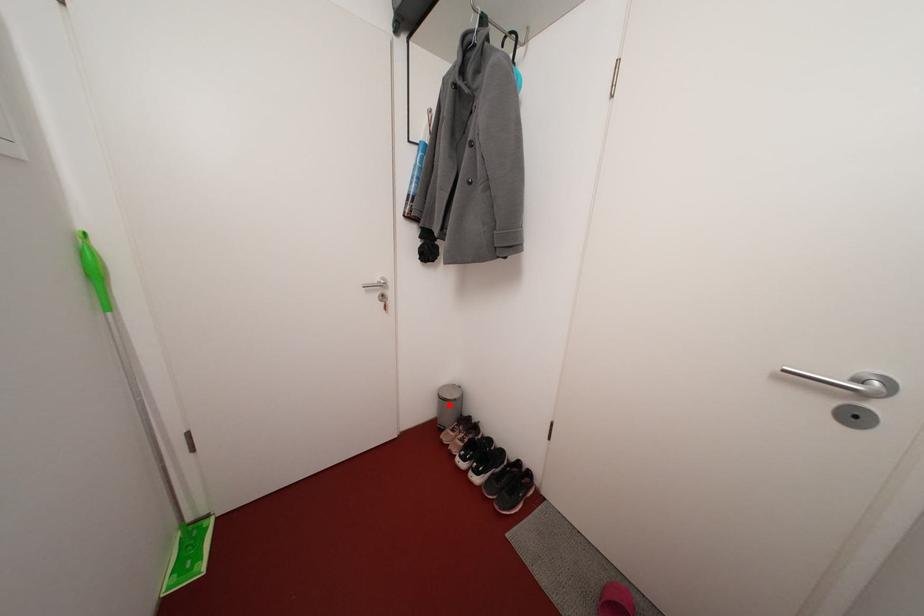
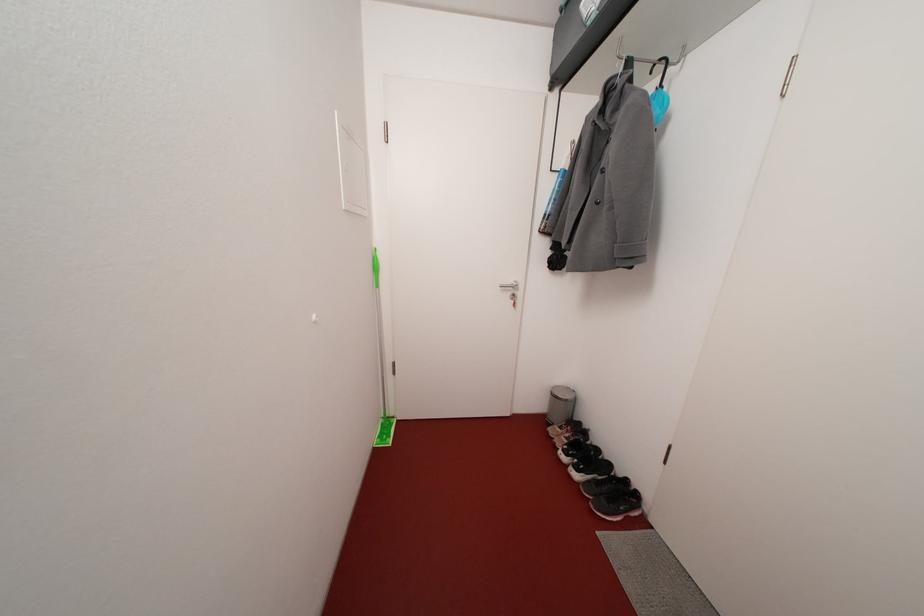
Locate, in the second image, the point that corresponds to the highlighted location in the first image.

(561, 402)